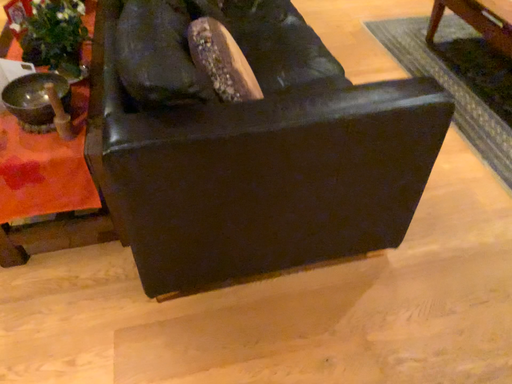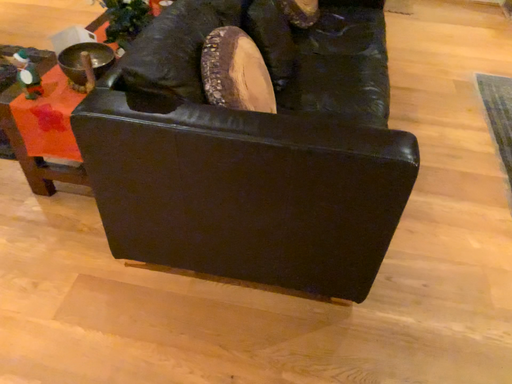
Question: Which way did the camera rotate in the video?

Choices:
 (A) rotated right
 (B) rotated left

Answer: (B)